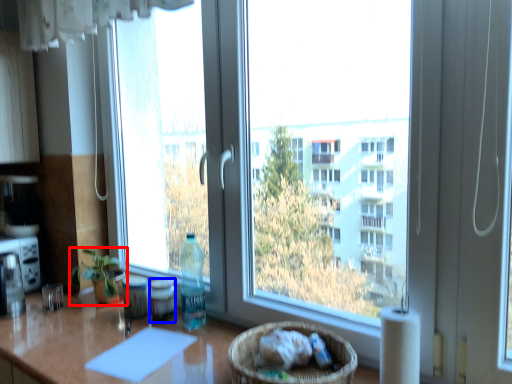
Question: Among these objects, which one is farthest to the camera, houseplant (highlighted by a red box) or bottle (highlighted by a blue box)?

Choices:
 (A) houseplant
 (B) bottle

Answer: (A)